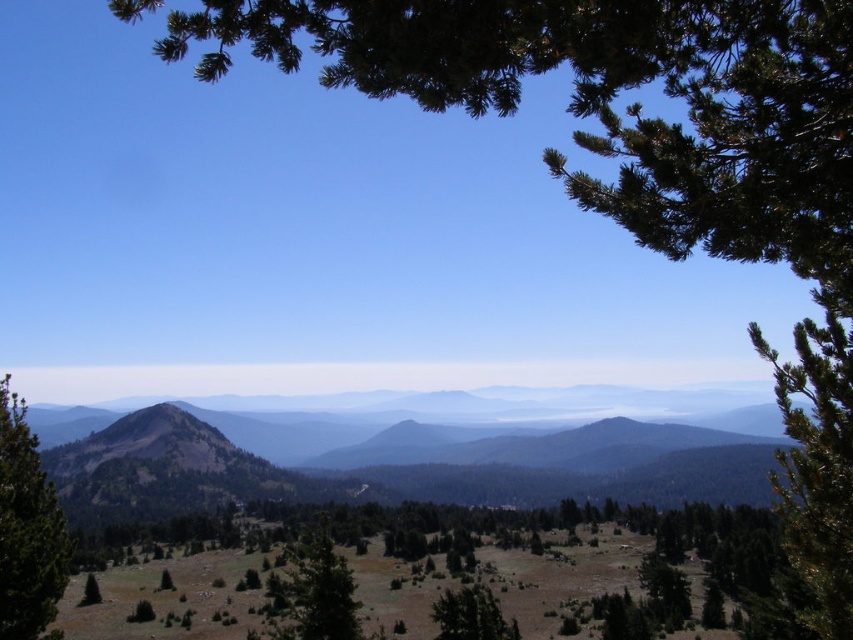
You are standing at point (401, 460) in the mountainous landscape. What can you see directly in front of you?

You can see a brown textured mountain at center directly in front of you at point (401, 460).